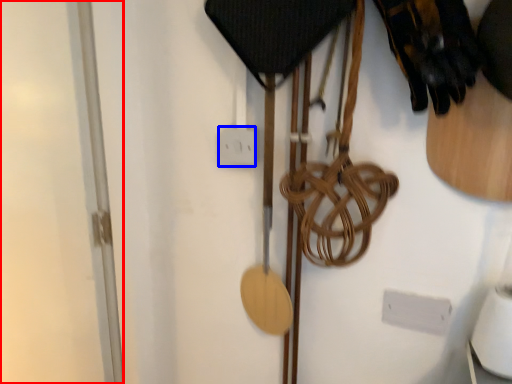
Question: Which object appears farthest to the camera in this image, glass door (highlighted by a red box) or electric outlet (highlighted by a blue box)?

Choices:
 (A) glass door
 (B) electric outlet

Answer: (B)